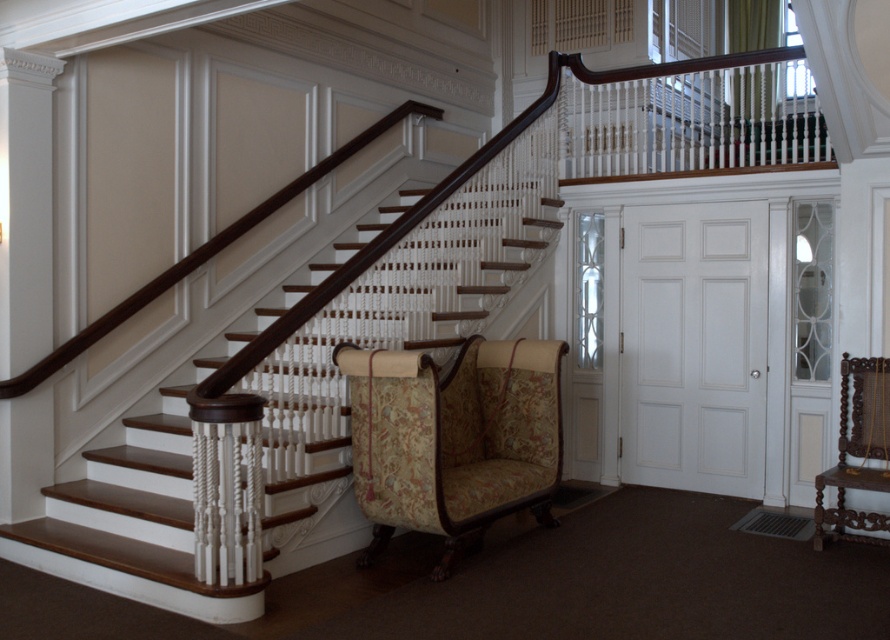
You are an interior designer planning to move a large sofa into this room. The sofa is as wide as the carved wood armchair at lower right. Can the sofa fit through the space between the wooden staircase at center and the wall?

The wooden staircase at center is wider than the carved wood armchair at lower right. Since the sofa is as wide as the armchair, it can fit through the space between the wooden staircase at center and the wall because the staircase is wider, providing sufficient space.

You are standing at the bottom of the staircase and want to move towards the white wood balustrade at upper center. Is the patterned fabric armchair at center blocking your path?

The patterned fabric armchair at center is in front of the white wood balustrade at upper center, so it is blocking the path to the white wood balustrade at upper center.

You are standing at the base of the grand staircase and want to take a photo of both point (409, 193) and point (751, 116). Which point is closer to your camera lens?

Point (751, 116) is closer to the camera lens because point (409, 193) is further away from the camera than point (751, 116).